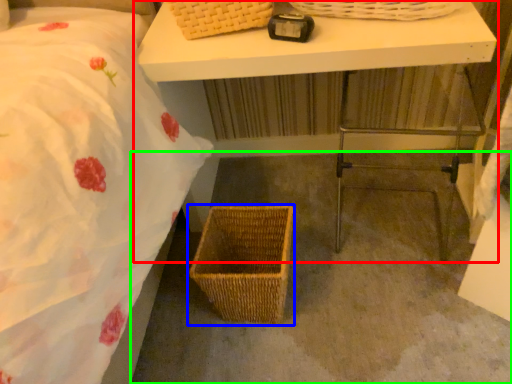
Question: Which object is the closest to the table (highlighted by a red box)? Choose among these: picnic basket (highlighted by a blue box) or concrete (highlighted by a green box).

Choices:
 (A) picnic basket
 (B) concrete

Answer: (B)